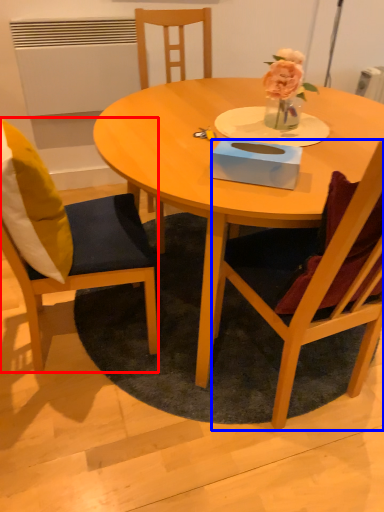
Question: Which point is closer to the camera, chair (highlighted by a red box) or chair (highlighted by a blue box)?

Choices:
 (A) chair
 (B) chair

Answer: (B)